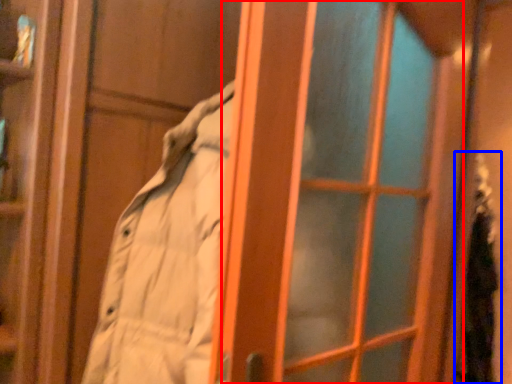
Question: Which of the following is the farthest to the observer, screen door (highlighted by a red box) or person (highlighted by a blue box)?

Choices:
 (A) screen door
 (B) person

Answer: (B)